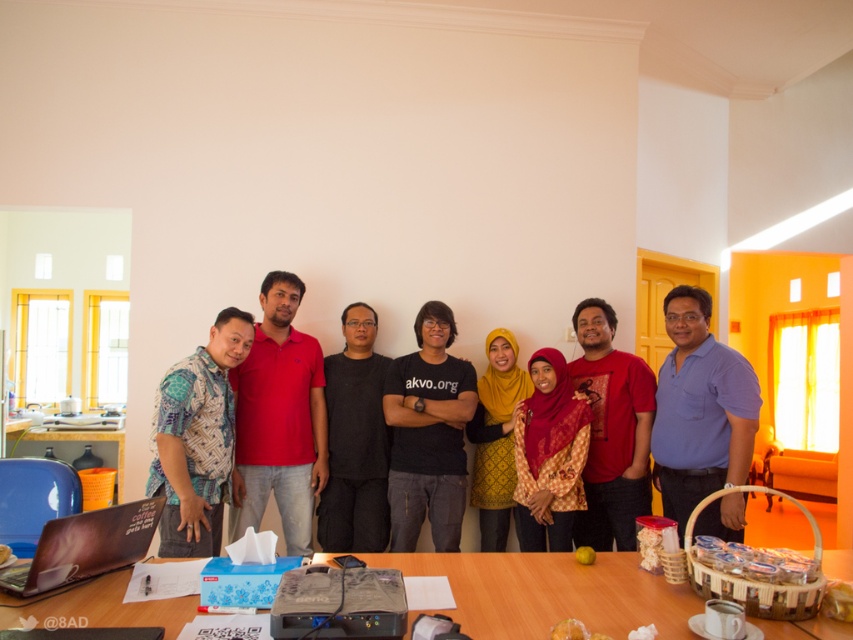
Between black cotton shirt at center and matte black laptop at lower left, which one has more height?

With more height is black cotton shirt at center.

Measure the distance between point (x=456, y=509) and camera.

A distance of 3.26 meters exists between point (x=456, y=509) and camera.

At what (x,y) coordinates should I click in order to perform the action: click on black cotton shirt at center. Please return your answer as a coordinate pair (x, y). Looking at the image, I should click on (428, 433).

In the scene shown: Is black matte shirt at center further to camera compared to yellow printed dress at center?

No, black matte shirt at center is closer to the viewer.

Identify the location of black matte shirt at center. (355, 442).

Where is `blue cotton shirt at right`? The width and height of the screenshot is (853, 640). blue cotton shirt at right is located at coordinates (699, 408).

At what (x,y) coordinates should I click in order to perform the action: click on blue cotton shirt at right. Please return your answer as a coordinate pair (x, y). The image size is (853, 640). Looking at the image, I should click on (699, 408).